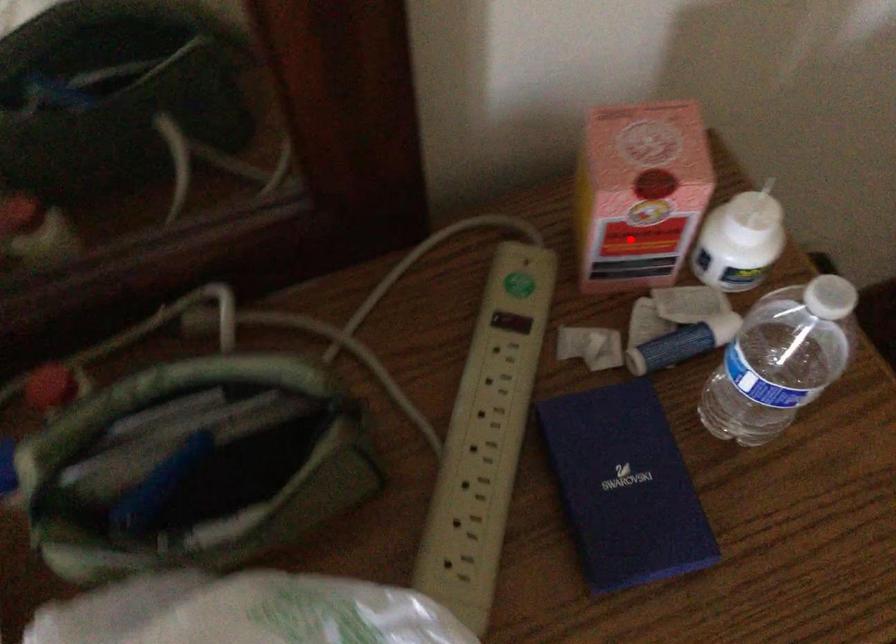
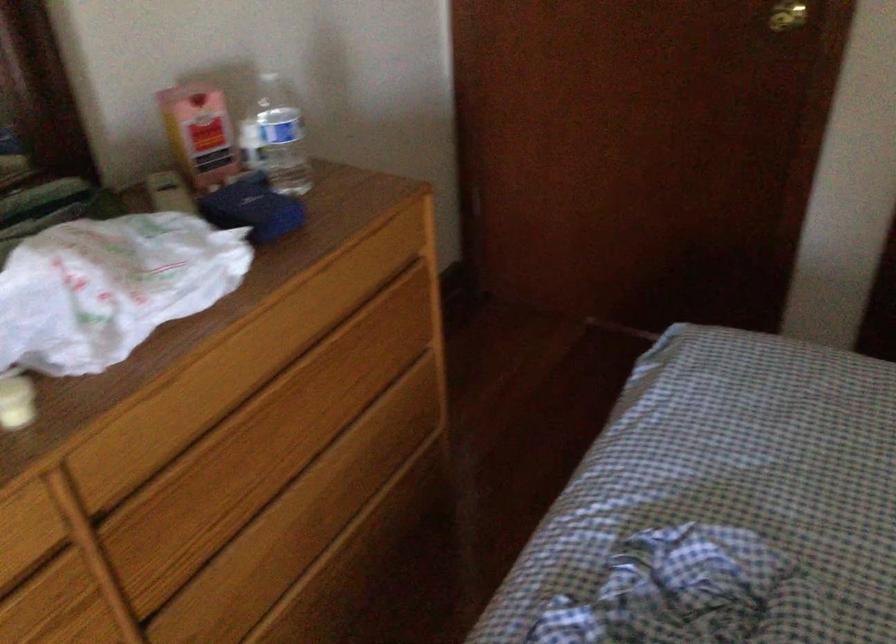
Question: I am providing you with two images of the same scene from different viewpoints. Given a red point in image1, look at the same physical point in image2. Is it:

Choices:
 (A) Closer to the viewpoint
 (B) Farther from the viewpoint

Answer: (B)